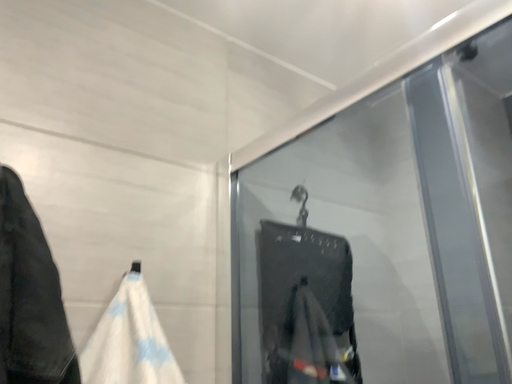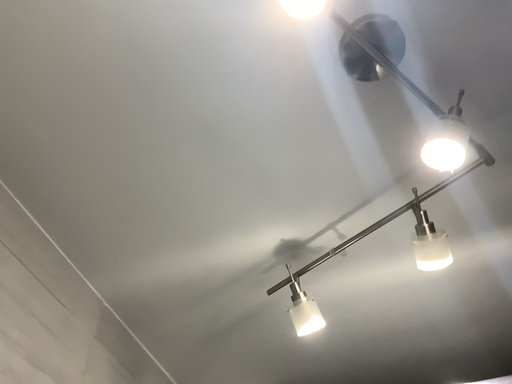
Question: Which way did the camera rotate in the video?

Choices:
 (A) rotated left
 (B) rotated right

Answer: (B)